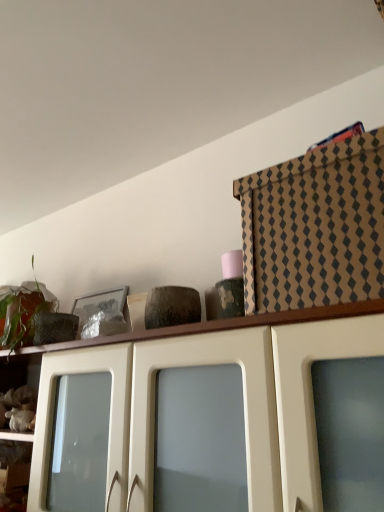
Question: Is brown cardboard box at upper right, placed as the 2th cabinetry when sorted from bottom to top, bigger or smaller than matte white cabinet at upper center, arranged as the second cabinetry when viewed from the top?

Choices:
 (A) big
 (B) small

Answer: (B)

Question: From the image's perspective, is brown cardboard box at upper right, which ranks as the 1th cabinetry in top-to-bottom order, above or below matte white cabinet at upper center, arranged as the second cabinetry when viewed from the top?

Choices:
 (A) below
 (B) above

Answer: (B)

Question: Which is farther from the green matte plant at upper left?

Choices:
 (A) brown cardboard box at upper right, which ranks as the 1th cabinetry in top-to-bottom order
 (B) matte white cabinet at upper center, arranged as the second cabinetry when viewed from the top

Answer: (A)

Question: Based on their relative distances, which object is nearer to the matte white cabinet at upper center, positioned as the 1th cabinetry in bottom-to-top order?

Choices:
 (A) brown cardboard box at upper right, placed as the 2th cabinetry when sorted from bottom to top
 (B) green matte plant at upper left

Answer: (A)